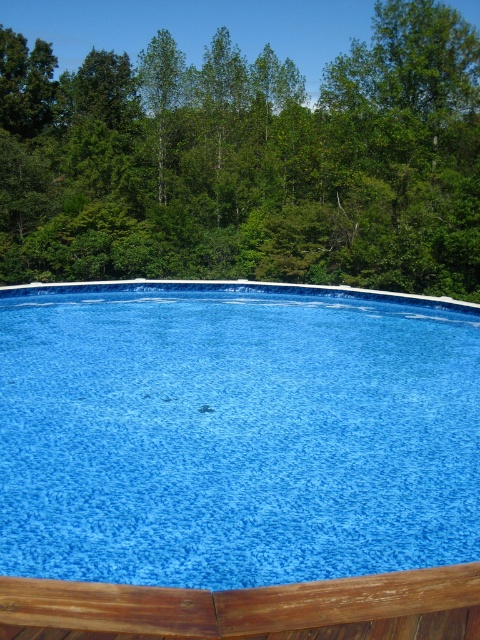
You are standing on the wooden deck and want to know which object is higher in the image. Can you tell me if the blue textured pool at center is higher or lower than the green leafy tree at upper center?

The blue textured pool at center is below the green leafy tree at upper center, so the green leafy tree at upper center is higher in the image.

You are standing on the wooden deck and see the point at coordinates (x=235, y=433). Which object is that point located on?

The point at coordinates (x=235, y=433) is located on the blue textured pool at center.